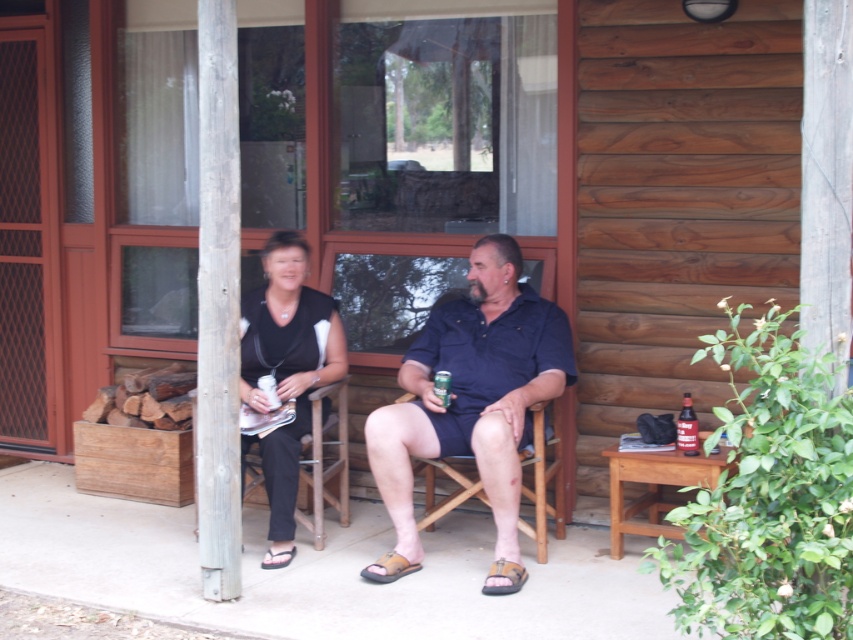
Question: Among these objects, which one is farthest from the camera?

Choices:
 (A) brown leather sandal at lower center
 (B) brown suede sandal at lower center
 (C) brown leather sandal at center

Answer: (A)

Question: Which is farther from the brown suede sandal at lower center?

Choices:
 (A) dark blue shirt at center
 (B) wooden chair at center
 (C) brown leather sandal at lower center
 (D) brown leather sandal at center

Answer: (C)

Question: Which object is farther from the camera taking this photo?

Choices:
 (A) brown suede sandal at lower center
 (B) wooden chair at center
 (C) dark blue shirt at center
 (D) brown leather sandal at lower center

Answer: (D)

Question: Can you confirm if dark blue shirt at center is positioned to the left of brown suede sandal at lower center?

Choices:
 (A) yes
 (B) no

Answer: (A)

Question: Does black fabric shirt at center appear over brown leather sandal at center?

Choices:
 (A) no
 (B) yes

Answer: (B)

Question: Is dark blue shirt at center to the left of brown suede sandal at lower center from the viewer's perspective?

Choices:
 (A) no
 (B) yes

Answer: (B)